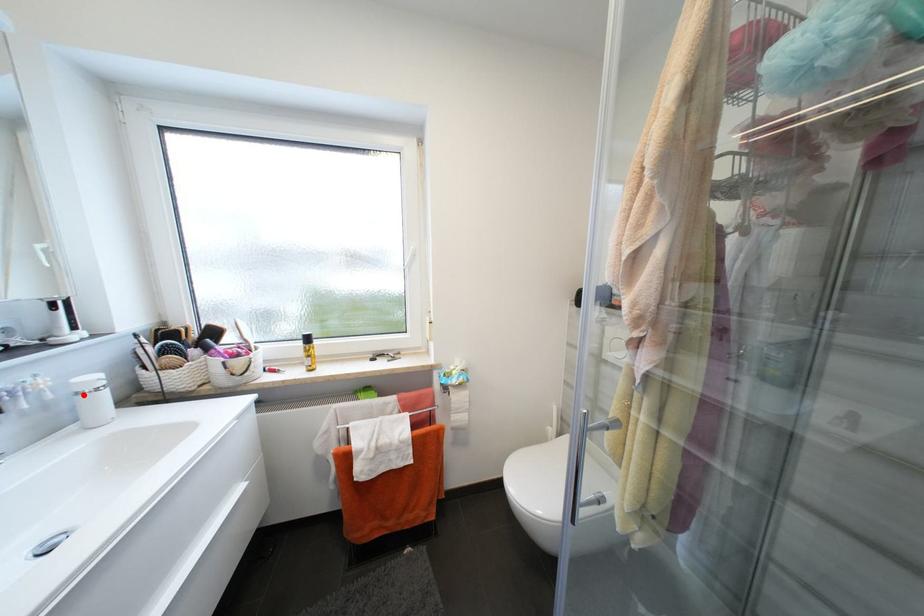
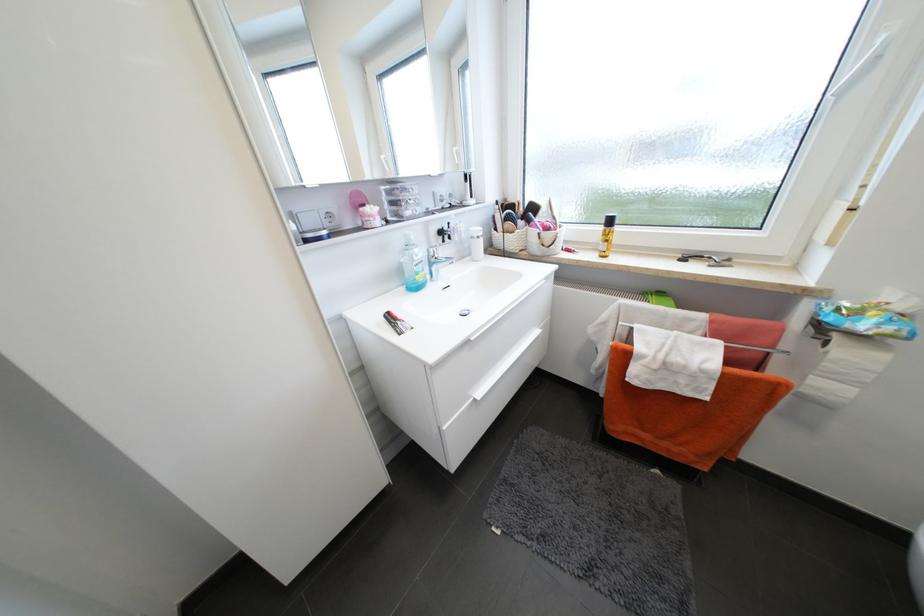
Question: I am providing you with two images of the same scene from different viewpoints. Image1 has a red point marked. In image2, the corresponding 3D location appears at what relative position? Reply with the corresponding letter.

Choices:
 (A) Closer
 (B) Farther

Answer: (A)